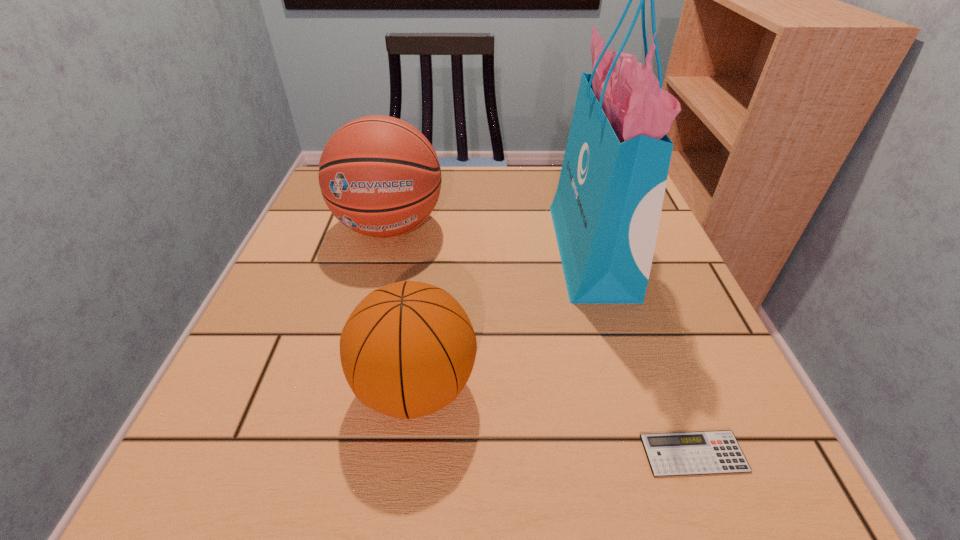
Identify the location of vacant space at the far edge of the desktop. The width and height of the screenshot is (960, 540). (537, 177).

Find the location of `vacant space at the near edge`. vacant space at the near edge is located at coordinates (603, 470).

Where is `free space at the left edge`? The width and height of the screenshot is (960, 540). free space at the left edge is located at coordinates tap(362, 248).

I want to click on free space at the right edge, so click(662, 430).

This screenshot has height=540, width=960. In order to click on vacant region at the far left corner of the desktop in this screenshot , I will do `click(318, 212)`.

At what (x,y) coordinates should I click in order to perform the action: click on empty space that is in between the calculator and the nearer basketball. Please return your answer as a coordinate pair (x, y). Image resolution: width=960 pixels, height=540 pixels. Looking at the image, I should click on (555, 420).

Identify the location of vacant region between the farther basketball and the calculator. The height and width of the screenshot is (540, 960). (541, 340).

Where is `unoccupied area between the shopping bag and the shortest object`? unoccupied area between the shopping bag and the shortest object is located at coordinates (642, 352).

This screenshot has height=540, width=960. What are the coordinates of `free area in between the tallest object and the shortest object` in the screenshot? It's located at (642, 352).

In order to click on vacant region between the tallest object and the shortest object in this screenshot , I will do `click(642, 352)`.